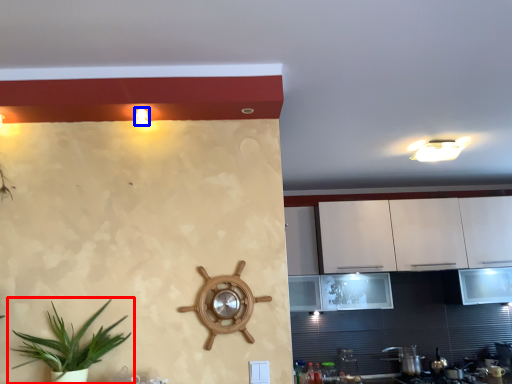
Question: Which object is closer to the camera taking this photo, houseplant (highlighted by a red box) or light fixture (highlighted by a blue box)?

Choices:
 (A) houseplant
 (B) light fixture

Answer: (A)